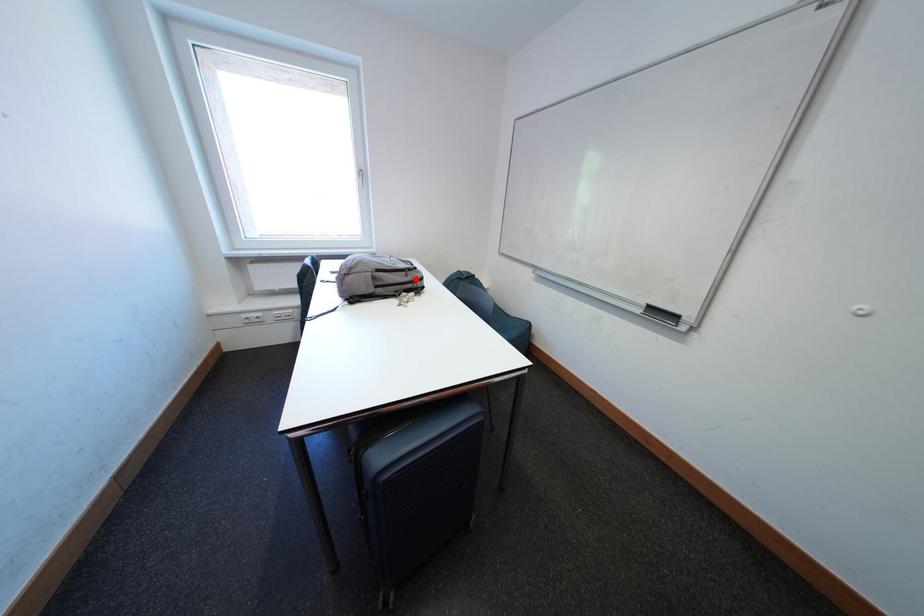
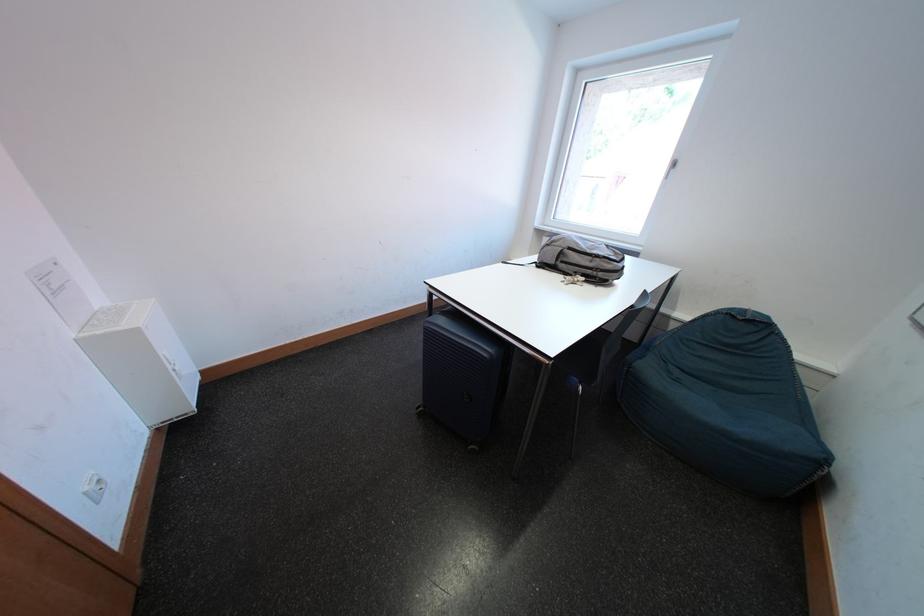
Locate, in the second image, the point that corresponds to the highlighted location in the first image.

(601, 265)